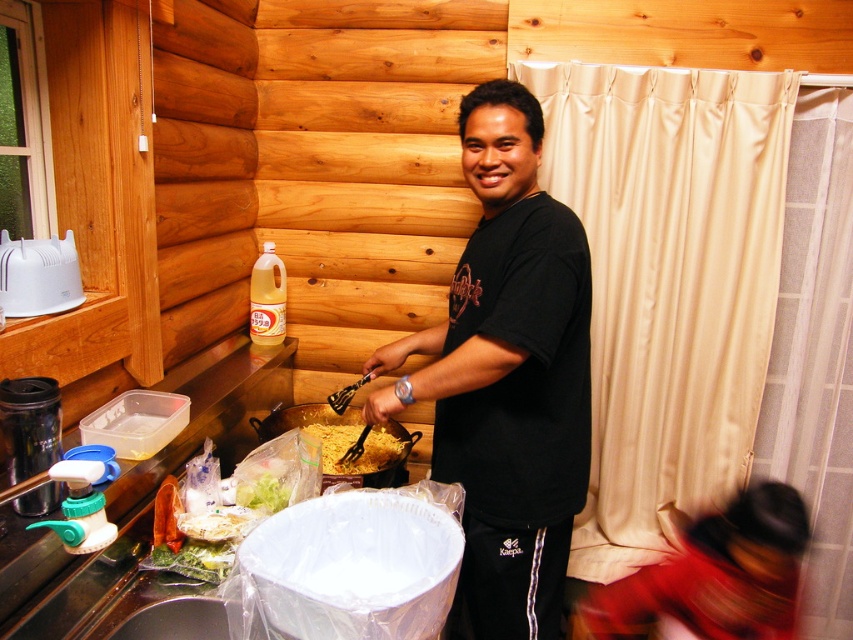
The image size is (853, 640). Identify the location of black matte shirt at center. (508, 374).

Does black matte shirt at center lie in front of smooth black shirt at center?

No, it is not.

Find the location of `black matte shirt at center`. black matte shirt at center is located at coordinates point(508,374).

You are a GUI agent. You are given a task and a screenshot of the screen. Output one action in this format:
    pyautogui.click(x=<x>, y=<y>)
    Task: Click on the black matte shirt at center
    The image size is (853, 640).
    Given the screenshot: What is the action you would take?
    [x=508, y=374]

Which is above, black matte shirt at center or yellow matte noodles at center?

black matte shirt at center is above.

Can you confirm if black matte shirt at center is positioned to the right of yellow matte noodles at center?

Yes, black matte shirt at center is to the right of yellow matte noodles at center.

Find the location of a particular element. This screenshot has width=853, height=640. black matte shirt at center is located at coordinates (508, 374).

Does smooth black shirt at center have a larger size compared to yellow matte noodles at center?

Correct, smooth black shirt at center is larger in size than yellow matte noodles at center.

Does smooth black shirt at center appear under yellow matte noodles at center?

Yes.

Does point (688, 548) come closer to viewer compared to point (332, 461)?

Yes, it is in front of point (332, 461).

At what (x,y) coordinates should I click in order to perform the action: click on smooth black shirt at center. Please return your answer as a coordinate pair (x, y). Image resolution: width=853 pixels, height=640 pixels. Looking at the image, I should click on (715, 576).